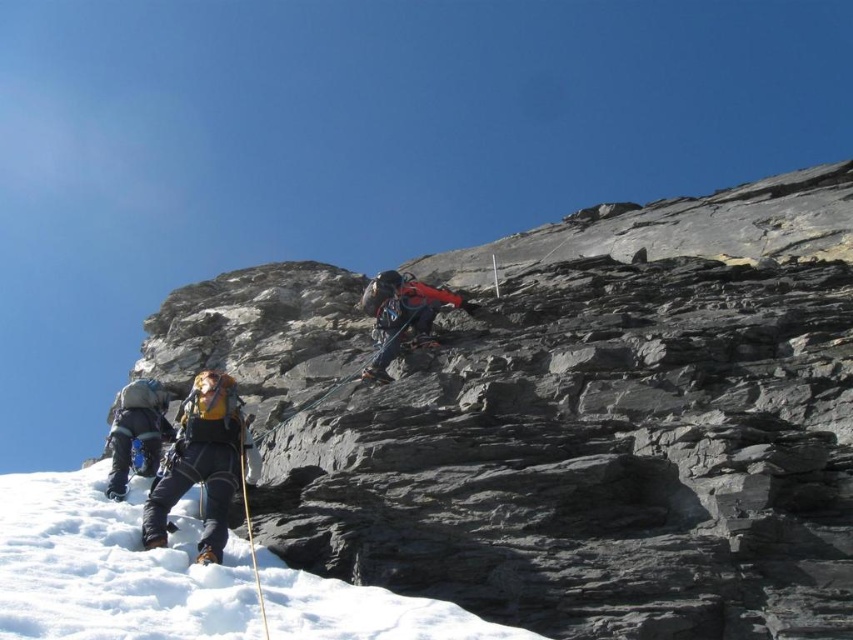
Question: Can you confirm if orange fabric harness at center is thinner than matte blue jacket at lower left?

Choices:
 (A) yes
 (B) no

Answer: (A)

Question: Observing the image, what is the correct spatial positioning of gray rock wall at upper center in reference to white powdery snow at lower left?

Choices:
 (A) left
 (B) right

Answer: (B)

Question: Is orange fabric harness at center smaller than matte blue jacket at lower left?

Choices:
 (A) no
 (B) yes

Answer: (B)

Question: Estimate the real-world distances between objects in this image. Which object is closer to the yellow fabric backpack at lower left?

Choices:
 (A) white powdery snow at lower left
 (B) matte blue jacket at lower left
 (C) orange fabric harness at center
 (D) gray rock wall at upper center

Answer: (A)

Question: Which of the following is the closest to the observer?

Choices:
 (A) orange fabric harness at center
 (B) matte blue jacket at lower left

Answer: (B)

Question: Which of the following is the closest to the observer?

Choices:
 (A) (231, 429)
 (B) (389, 289)

Answer: (A)